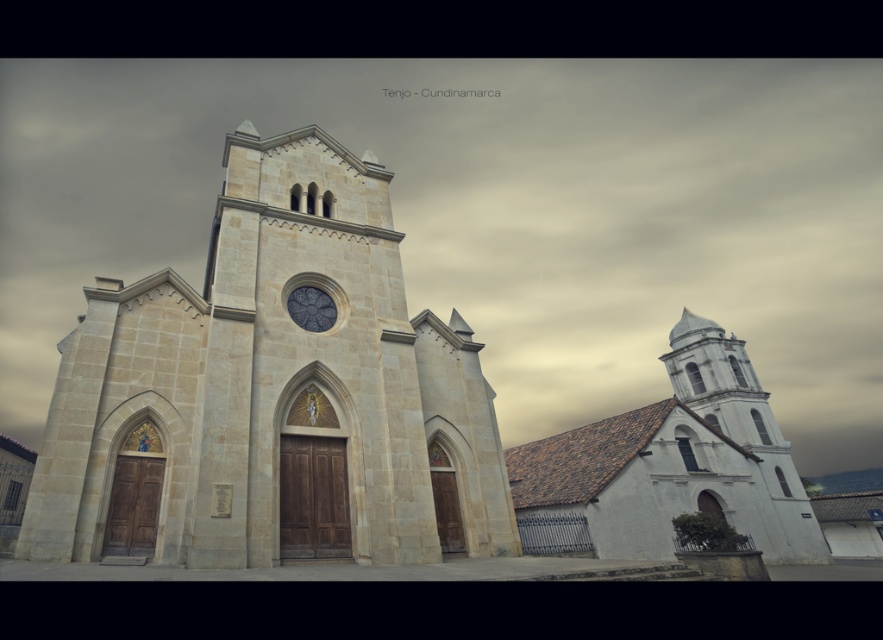
The height and width of the screenshot is (640, 883). Describe the element at coordinates (272, 394) in the screenshot. I see `light beige stone church tower at center` at that location.

Based on the photo, can you confirm if light beige stone church tower at center is positioned below stained glass window at center?

Yes.

Identify the location of light beige stone church tower at center. This screenshot has width=883, height=640. [x=272, y=394].